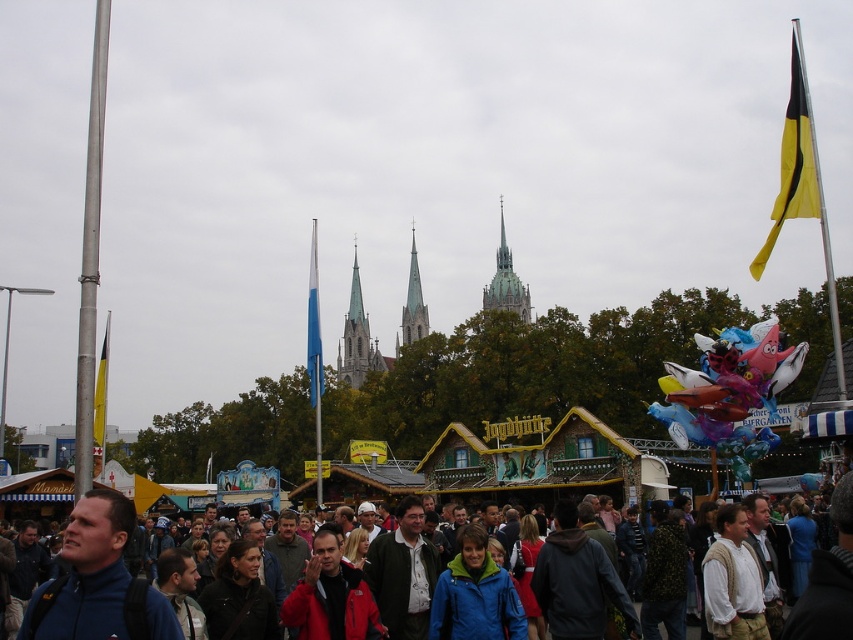
Between point (782, 154) and point (381, 356), which one is positioned in front?

Point (782, 154) is in front.

Between yellow fabric flag at upper right and smooth gray stone tower at center, which one is positioned higher?

yellow fabric flag at upper right is above.

The image size is (853, 640). What are the coordinates of `yellow fabric flag at upper right` in the screenshot? It's located at (795, 163).

Can you confirm if yellow fabric flag at upper right is taller than blue fabric flag at center?

Indeed, yellow fabric flag at upper right has a greater height compared to blue fabric flag at center.

Is yellow fabric flag at upper right positioned behind blue fabric flag at center?

No, yellow fabric flag at upper right is in front of blue fabric flag at center.

Measure the distance between point (796, 104) and camera.

A distance of 98.00 meters exists between point (796, 104) and camera.

I want to click on yellow fabric flag at upper right, so tap(795, 163).

Which is behind, point (346, 344) or point (410, 248)?

The point (410, 248) is behind.

Who is higher up, smooth gray stone tower at center or green stone tower at center?

Positioned higher is green stone tower at center.

Who is more forward, (367, 333) or (412, 308)?

Point (412, 308)

Where is `smooth gray stone tower at center`? smooth gray stone tower at center is located at coordinates tap(357, 339).